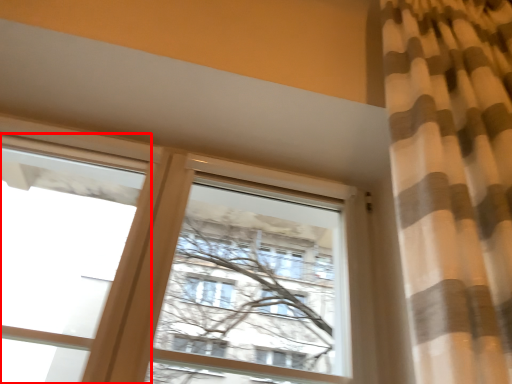
Question: Where is window (annotated by the red box) located in relation to window in the image?

Choices:
 (A) left
 (B) right

Answer: (A)